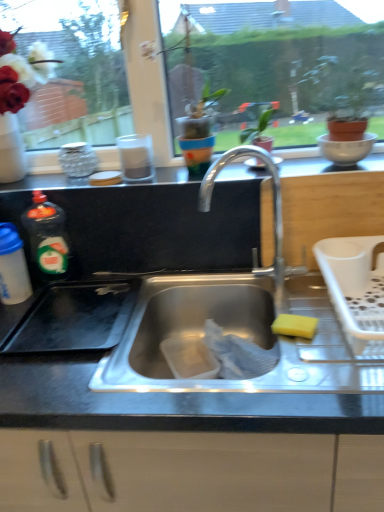
Question: From a real-world perspective, is translucent plastic bottle at left, placed as the 1th bottle when sorted from right to left, on black matte counter top at upper center?

Choices:
 (A) no
 (B) yes

Answer: (A)

Question: Is translucent plastic bottle at left, placed as the 1th bottle when sorted from right to left, aimed at black matte counter top at upper center?

Choices:
 (A) no
 (B) yes

Answer: (A)

Question: Does translucent plastic bottle at left, arranged as the 2th bottle when viewed from the left, have a smaller size compared to black matte counter top at upper center?

Choices:
 (A) yes
 (B) no

Answer: (A)

Question: Considering the relative sizes of translucent plastic bottle at left, arranged as the 2th bottle when viewed from the left, and black matte counter top at upper center in the image provided, is translucent plastic bottle at left, arranged as the 2th bottle when viewed from the left, thinner than black matte counter top at upper center?

Choices:
 (A) yes
 (B) no

Answer: (A)

Question: Can you confirm if translucent plastic bottle at left, placed as the 1th bottle when sorted from right to left, is shorter than black matte counter top at upper center?

Choices:
 (A) no
 (B) yes

Answer: (A)

Question: Does translucent plastic bottle at left, arranged as the 2th bottle when viewed from the left, come behind black matte counter top at upper center?

Choices:
 (A) yes
 (B) no

Answer: (A)

Question: Is polished metal faucet at center at the left side of transparent glass window screen at upper center?

Choices:
 (A) no
 (B) yes

Answer: (A)

Question: Does polished metal faucet at center have a smaller size compared to transparent glass window screen at upper center?

Choices:
 (A) no
 (B) yes

Answer: (B)

Question: Is polished metal faucet at center not within transparent glass window screen at upper center?

Choices:
 (A) no
 (B) yes

Answer: (B)

Question: Is polished metal faucet at center far away from transparent glass window screen at upper center?

Choices:
 (A) yes
 (B) no

Answer: (B)

Question: From the image's perspective, is polished metal faucet at center beneath transparent glass window screen at upper center?

Choices:
 (A) yes
 (B) no

Answer: (A)

Question: Is polished metal faucet at center bigger than transparent glass window screen at upper center?

Choices:
 (A) no
 (B) yes

Answer: (A)

Question: From a real-world perspective, is white plastic dish rack at right located higher than yellow sponge at sink right?

Choices:
 (A) no
 (B) yes

Answer: (B)